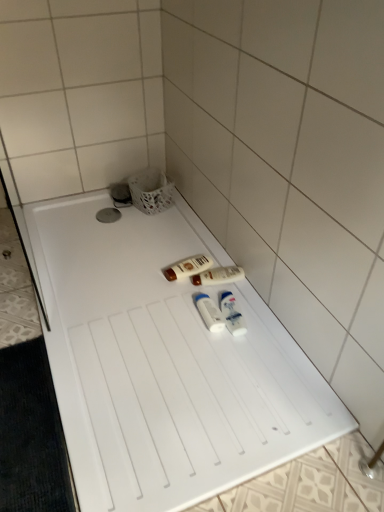
Where is `free space on the front side of white plastic bottles at center, the fourth toiletry positioned from the back`? This screenshot has height=512, width=384. free space on the front side of white plastic bottles at center, the fourth toiletry positioned from the back is located at coordinates (230, 357).